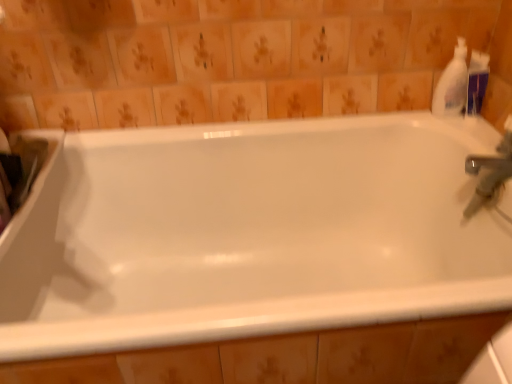
Question: Should I look upward or downward to see white glossy bathtub at center?

Choices:
 (A) up
 (B) down

Answer: (B)

Question: Is white plastic bottle at upper right to the left of white glossy bathtub at center from the viewer's perspective?

Choices:
 (A) yes
 (B) no

Answer: (B)

Question: Considering the relative sizes of white plastic bottle at upper right and white glossy bathtub at center in the image provided, is white plastic bottle at upper right taller than white glossy bathtub at center?

Choices:
 (A) yes
 (B) no

Answer: (B)

Question: From a real-world perspective, is white plastic bottle at upper right under white glossy bathtub at center?

Choices:
 (A) yes
 (B) no

Answer: (B)

Question: Considering the relative sizes of white plastic bottle at upper right and white glossy bathtub at center in the image provided, is white plastic bottle at upper right thinner than white glossy bathtub at center?

Choices:
 (A) yes
 (B) no

Answer: (A)

Question: Is white plastic bottle at upper right positioned before white glossy bathtub at center?

Choices:
 (A) no
 (B) yes

Answer: (A)

Question: From the image's perspective, would you say white plastic bottle at upper right is shown under white glossy bathtub at center?

Choices:
 (A) no
 (B) yes

Answer: (A)

Question: Can you confirm if white glossy bathtub at center is shorter than white plastic bottle at upper right?

Choices:
 (A) no
 (B) yes

Answer: (A)

Question: From the image's perspective, is white glossy bathtub at center below white plastic bottle at upper right?

Choices:
 (A) no
 (B) yes

Answer: (B)

Question: Is the depth of white glossy bathtub at center greater than that of white plastic bottle at upper right?

Choices:
 (A) yes
 (B) no

Answer: (B)

Question: Would you say white glossy bathtub at center is outside white plastic bottle at upper right?

Choices:
 (A) yes
 (B) no

Answer: (A)

Question: Is white glossy bathtub at center far from white plastic bottle at upper right?

Choices:
 (A) yes
 (B) no

Answer: (B)

Question: Can you confirm if white glossy bathtub at center is thinner than white plastic bottle at upper right?

Choices:
 (A) no
 (B) yes

Answer: (A)

Question: Considering the positions of white plastic bottle at upper right and white glossy bathtub at center in the image, is white plastic bottle at upper right wider or thinner than white glossy bathtub at center?

Choices:
 (A) thin
 (B) wide

Answer: (A)